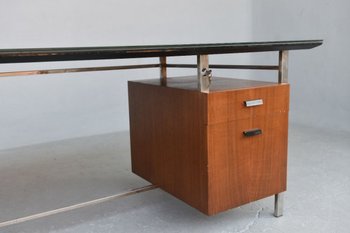
This screenshot has height=233, width=350. In order to click on drawer in this screenshot , I will do `click(252, 103)`, `click(254, 132)`.